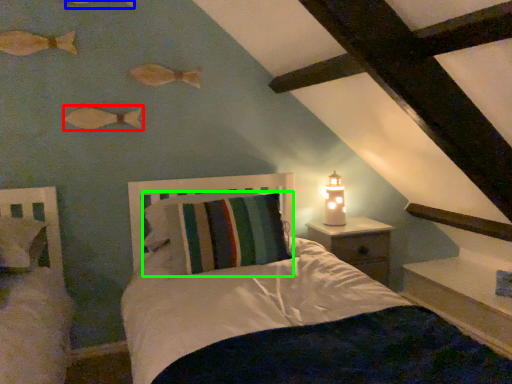
Question: Which object is the farthest from fish (highlighted by a red box)? Choose among these: fish (highlighted by a blue box) or pillow (highlighted by a green box).

Choices:
 (A) fish
 (B) pillow

Answer: (B)